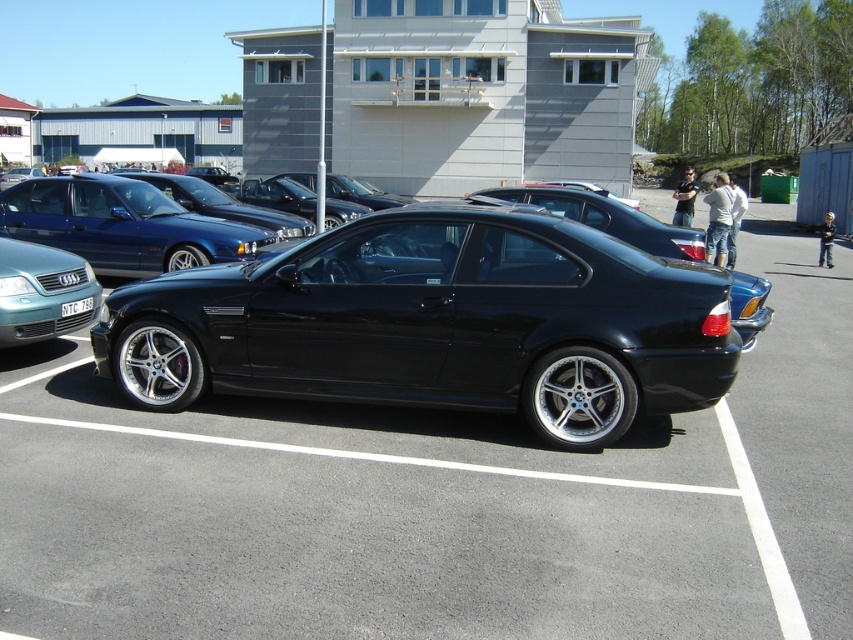
Based on the photo, between black metallic car at center and matte blue sedan at left, which one is positioned lower?

black metallic car at center

Is point (115, 292) farther from camera compared to point (97, 284)?

No, it is not.

Is point (399, 296) positioned in front of point (25, 260)?

Yes, it is in front of point (25, 260).

You are a GUI agent. You are given a task and a screenshot of the screen. Output one action in this format:
    pyautogui.click(x=<x>, y=<y>)
    Task: Click on the black metallic car at center
    The height and width of the screenshot is (640, 853).
    Given the screenshot: What is the action you would take?
    pyautogui.click(x=437, y=323)

Does metallic blue sedan at left have a lesser width compared to white plastic license plate at center?

No.

Which is in front, point (86, 228) or point (64, 314)?

Positioned in front is point (64, 314).

The image size is (853, 640). Find the location of `metallic blue sedan at left`. metallic blue sedan at left is located at coordinates (122, 225).

Is point (374, 234) positioned in front of point (70, 314)?

Yes, it is in front of point (70, 314).

Is black metallic car at center smaller than white plastic license plate at center?

No.

Does point (192, 362) lie behind point (77, 310)?

No, (192, 362) is closer to viewer.

Locate an element on the screen. This screenshot has width=853, height=640. black metallic car at center is located at coordinates (437, 323).